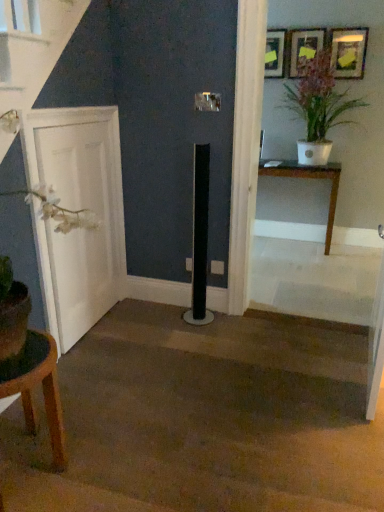
This screenshot has width=384, height=512. In order to click on vacant region below brown wooden table at lower left, the second table positioned from the top (from a real-world perspective) in this screenshot , I will do `click(23, 462)`.